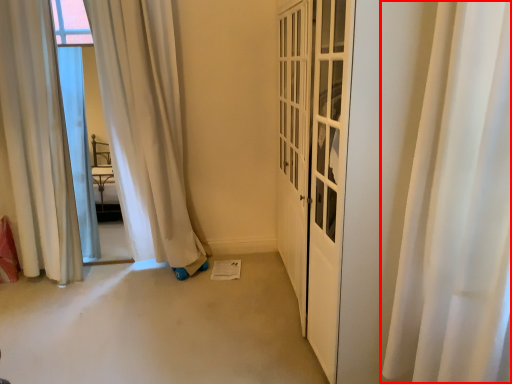
Question: From the image's perspective, what is the correct spatial relationship of curtain (annotated by the red box) in relation to curtain?

Choices:
 (A) above
 (B) below

Answer: (B)